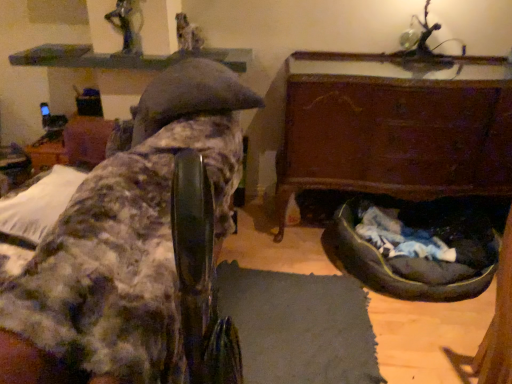
What is the approximate height of dark gray fabric dog bed at lower right?

29.50 centimeters.

The width and height of the screenshot is (512, 384). I want to click on smooth gray statue at upper center, which ranks as the 2th person in left-to-right order, so click(188, 34).

Identify the location of wooden chest at lower right, the 2th furniture positioned from the left. (395, 127).

The width and height of the screenshot is (512, 384). I want to click on metallic statue at upper center, which is counted as the 1th person, starting from the left, so click(128, 25).

Locate an element on the screen. The height and width of the screenshot is (384, 512). fuzzy fabric chair at upper left, which ranks as the 1th furniture in left-to-right order is located at coordinates (125, 244).

Where is `dark gray fabric dog bed at lower right`? This screenshot has width=512, height=384. dark gray fabric dog bed at lower right is located at coordinates (418, 257).

Which object is further away from the camera, wooden chest at lower right, acting as the first furniture starting from the right, or dark gray fabric dog bed at lower right?

Positioned behind is wooden chest at lower right, acting as the first furniture starting from the right.

Would you say wooden chest at lower right, the 2th furniture positioned from the left, contains dark gray fabric dog bed at lower right?

Yes, wooden chest at lower right, the 2th furniture positioned from the left, is surrounding dark gray fabric dog bed at lower right.

From a real-world perspective, is wooden chest at lower right, acting as the first furniture starting from the right, above or below dark gray fabric dog bed at lower right?

wooden chest at lower right, acting as the first furniture starting from the right, is above dark gray fabric dog bed at lower right.

Is wooden chest at lower right, the 2th furniture positioned from the left, shorter than smooth gray statue at upper center, which ranks as the 2th person in left-to-right order?

No.

Does wooden chest at lower right, the 2th furniture positioned from the left, appear on the right side of smooth gray statue at upper center, which is the 1th person in back-to-front order?

Indeed, wooden chest at lower right, the 2th furniture positioned from the left, is positioned on the right side of smooth gray statue at upper center, which is the 1th person in back-to-front order.

Locate an element on the screen. This screenshot has width=512, height=384. the 1st furniture in front of the smooth gray statue at upper center, which is the second person in front-to-back order is located at coordinates (395, 127).

In the scene shown: Which is closer, (425, 273) or (197, 34)?

Point (425, 273) is closer to the camera than point (197, 34).

Is dark gray fabric dog bed at lower right not near smooth gray statue at upper center, which ranks as the 2th person in left-to-right order?

Absolutely, dark gray fabric dog bed at lower right is distant from smooth gray statue at upper center, which ranks as the 2th person in left-to-right order.

Who is bigger, dark gray fabric dog bed at lower right or smooth gray statue at upper center, the 1th person when ordered from right to left?

Bigger between the two is dark gray fabric dog bed at lower right.

Is dark gray fabric dog bed at lower right oriented towards smooth gray statue at upper center, which is the 1th person in back-to-front order?

No, dark gray fabric dog bed at lower right does not turn towards smooth gray statue at upper center, which is the 1th person in back-to-front order.

From the image's perspective, is smooth gray statue at upper center, which is the 1th person in back-to-front order, below dark gray fabric dog bed at lower right?

No.

How many degrees apart are the facing directions of smooth gray statue at upper center, which is the second person in front-to-back order, and dark gray fabric dog bed at lower right?

The facing directions of smooth gray statue at upper center, which is the second person in front-to-back order, and dark gray fabric dog bed at lower right are 5.29 degrees apart.

Find the location of a particular element. The height and width of the screenshot is (384, 512). dog bed below the smooth gray statue at upper center, which ranks as the 2th person in left-to-right order (from the image's perspective) is located at coordinates (418, 257).

Which of these two, smooth gray statue at upper center, which is the 1th person in back-to-front order, or dark gray fabric dog bed at lower right, stands taller?

dark gray fabric dog bed at lower right.

From a real-world perspective, is metallic statue at upper center, acting as the 2th person starting from the right, physically below dark gray fabric dog bed at lower right?

No, from a real-world perspective, metallic statue at upper center, acting as the 2th person starting from the right, is not under dark gray fabric dog bed at lower right.

From the picture: From the image's perspective, is metallic statue at upper center, acting as the 2th person starting from the right, on top of dark gray fabric dog bed at lower right?

Yes, from the image's perspective, metallic statue at upper center, acting as the 2th person starting from the right, is on top of dark gray fabric dog bed at lower right.

Does metallic statue at upper center, acting as the 2th person starting from the right, appear on the right side of dark gray fabric dog bed at lower right?

Incorrect, metallic statue at upper center, acting as the 2th person starting from the right, is not on the right side of dark gray fabric dog bed at lower right.

Considering the sizes of objects metallic statue at upper center, arranged as the 1th person when viewed from the front, and dark gray fabric dog bed at lower right in the image provided, who is smaller, metallic statue at upper center, arranged as the 1th person when viewed from the front, or dark gray fabric dog bed at lower right?

Smaller between the two is metallic statue at upper center, arranged as the 1th person when viewed from the front.

Starting from the dark gray fabric dog bed at lower right, which person is the 1st one behind? Please provide its 2D coordinates.

[(128, 25)]

Would you consider dark gray fabric dog bed at lower right to be distant from metallic statue at upper center, arranged as the 1th person when viewed from the front?

Yes, dark gray fabric dog bed at lower right and metallic statue at upper center, arranged as the 1th person when viewed from the front, are located far from each other.

Looking at this image, which object is closer to the camera, dark gray fabric dog bed at lower right or metallic statue at upper center, which is counted as the 1th person, starting from the left?

dark gray fabric dog bed at lower right is in front.

Considering the relative sizes of dark gray fabric dog bed at lower right and metallic statue at upper center, acting as the 2th person starting from the right, in the image provided, is dark gray fabric dog bed at lower right thinner than metallic statue at upper center, acting as the 2th person starting from the right,?

In fact, dark gray fabric dog bed at lower right might be wider than metallic statue at upper center, acting as the 2th person starting from the right.

From a real-world perspective, is metallic statue at upper center, acting as the 2th person starting from the right, beneath fuzzy fabric chair at upper left, which ranks as the second furniture in right-to-left order?

Actually, metallic statue at upper center, acting as the 2th person starting from the right, is physically above fuzzy fabric chair at upper left, which ranks as the second furniture in right-to-left order, in the real world.

Is metallic statue at upper center, which is counted as the 1th person, starting from the left, with fuzzy fabric chair at upper left, which ranks as the 1th furniture in left-to-right order?

They are not placed beside each other.

Is metallic statue at upper center, arranged as the 1th person when viewed from the front, positioned behind fuzzy fabric chair at upper left, which ranks as the 1th furniture in left-to-right order?

That is True.

From the image's perspective, is metallic statue at upper center, which is counted as the 1th person, starting from the left, beneath fuzzy fabric chair at upper left, which ranks as the 1th furniture in left-to-right order?

Incorrect, from the image's perspective, metallic statue at upper center, which is counted as the 1th person, starting from the left, is higher than fuzzy fabric chair at upper left, which ranks as the 1th furniture in left-to-right order.

Locate an element on the screen. The width and height of the screenshot is (512, 384). dog bed below the wooden chest at lower right, the 2th furniture positioned from the left (from a real-world perspective) is located at coordinates (418, 257).

At what (x,y) coordinates should I click in order to perform the action: click on the 1st person counting from the left of the wooden chest at lower right, acting as the first furniture starting from the right. Please return your answer as a coordinate pair (x, y). The height and width of the screenshot is (384, 512). Looking at the image, I should click on (188, 34).

Considering their positions, is metallic statue at upper center, acting as the 2th person starting from the right, positioned further to dark gray fabric dog bed at lower right than fuzzy fabric chair at upper left, which ranks as the second furniture in right-to-left order?

The object further to dark gray fabric dog bed at lower right is metallic statue at upper center, acting as the 2th person starting from the right.

Looking at the image, which one is located further to fuzzy fabric chair at upper left, which ranks as the second furniture in right-to-left order, metallic statue at upper center, the second person when ordered from back to front, or wooden chest at lower right, acting as the first furniture starting from the right?

metallic statue at upper center, the second person when ordered from back to front, is further to fuzzy fabric chair at upper left, which ranks as the second furniture in right-to-left order.

When comparing their distances from smooth gray statue at upper center, the 1th person when ordered from right to left, does dark gray fabric dog bed at lower right or wooden chest at lower right, the 2th furniture positioned from the left, seem further?

dark gray fabric dog bed at lower right is positioned further to the anchor smooth gray statue at upper center, the 1th person when ordered from right to left.

Looking at the image, which one is located further to dark gray fabric dog bed at lower right, fuzzy fabric chair at upper left, which ranks as the second furniture in right-to-left order, or metallic statue at upper center, arranged as the 1th person when viewed from the front?

The object further to dark gray fabric dog bed at lower right is metallic statue at upper center, arranged as the 1th person when viewed from the front.

Looking at the image, which one is located closer to dark gray fabric dog bed at lower right, wooden chest at lower right, acting as the first furniture starting from the right, or smooth gray statue at upper center, which is the 1th person in back-to-front order?

wooden chest at lower right, acting as the first furniture starting from the right, is closer to dark gray fabric dog bed at lower right.

Estimate the real-world distances between objects in this image. Which object is closer to dark gray fabric dog bed at lower right, metallic statue at upper center, arranged as the 1th person when viewed from the front, or wooden chest at lower right, acting as the first furniture starting from the right?

wooden chest at lower right, acting as the first furniture starting from the right, is positioned closer to the anchor dark gray fabric dog bed at lower right.

Looking at the image, which one is located further to wooden chest at lower right, the 2th furniture positioned from the left, metallic statue at upper center, arranged as the 1th person when viewed from the front, or fuzzy fabric chair at upper left, which ranks as the 1th furniture in left-to-right order?

metallic statue at upper center, arranged as the 1th person when viewed from the front, is further to wooden chest at lower right, the 2th furniture positioned from the left.

Based on their spatial positions, is fuzzy fabric chair at upper left, which ranks as the second furniture in right-to-left order, or metallic statue at upper center, arranged as the 1th person when viewed from the front, further from smooth gray statue at upper center, which is the 1th person in back-to-front order?

Based on the image, fuzzy fabric chair at upper left, which ranks as the second furniture in right-to-left order, appears to be further to smooth gray statue at upper center, which is the 1th person in back-to-front order.

You are a GUI agent. You are given a task and a screenshot of the screen. Output one action in this format:
    pyautogui.click(x=<x>, y=<y>)
    Task: Click on the furniture situated between fuzzy fabric chair at upper left, which ranks as the second furniture in right-to-left order, and dark gray fabric dog bed at lower right from left to right
    This screenshot has width=512, height=384.
    Given the screenshot: What is the action you would take?
    pyautogui.click(x=395, y=127)

At what (x,y) coordinates should I click in order to perform the action: click on person between metallic statue at upper center, which is counted as the 1th person, starting from the left, and dark gray fabric dog bed at lower right from left to right. Please return your answer as a coordinate pair (x, y). Image resolution: width=512 pixels, height=384 pixels. Looking at the image, I should click on (188, 34).

You are a GUI agent. You are given a task and a screenshot of the screen. Output one action in this format:
    pyautogui.click(x=<x>, y=<y>)
    Task: Click on the person located between fuzzy fabric chair at upper left, which ranks as the second furniture in right-to-left order, and smooth gray statue at upper center, which ranks as the 2th person in left-to-right order, in the depth direction
    
    Given the screenshot: What is the action you would take?
    pyautogui.click(x=128, y=25)

At what (x,y) coordinates should I click in order to perform the action: click on furniture between fuzzy fabric chair at upper left, which ranks as the 1th furniture in left-to-right order, and smooth gray statue at upper center, which is the second person in front-to-back order, in the front-back direction. Please return your answer as a coordinate pair (x, y). Looking at the image, I should click on (395, 127).